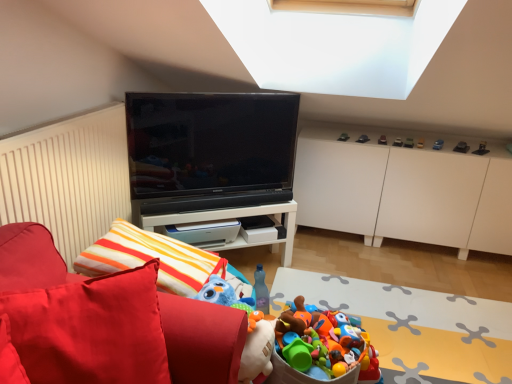
Find the location of a particular element. The height and width of the screenshot is (384, 512). vacant space situated on the left part of metallic gray toy car at upper right, the eighth toy from the top is located at coordinates (442, 144).